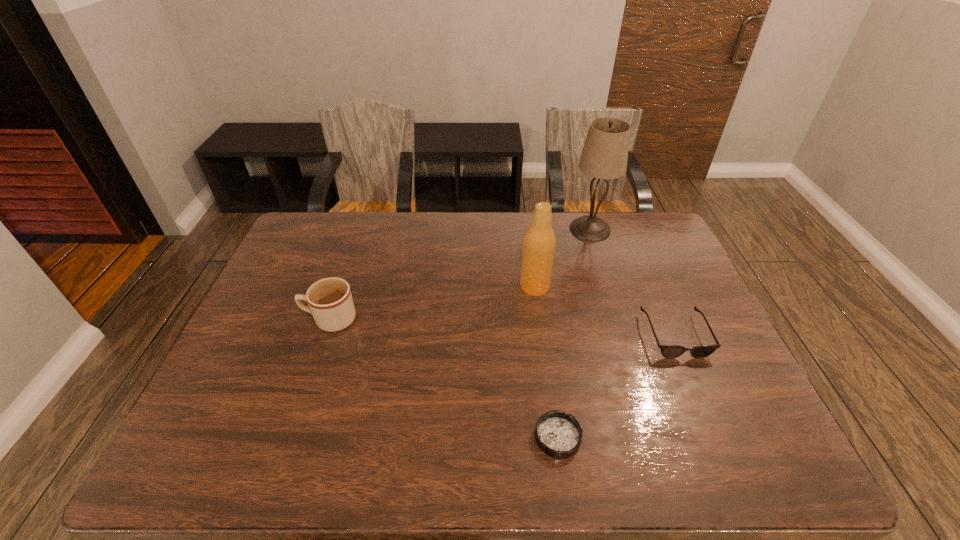
You are a GUI agent. You are given a task and a screenshot of the screen. Output one action in this format:
    pyautogui.click(x=<x>, y=<y>)
    Task: Click on the vacant position at the left edge of the desktop
    The height and width of the screenshot is (540, 960).
    Given the screenshot: What is the action you would take?
    pyautogui.click(x=280, y=272)

You are a GUI agent. You are given a task and a screenshot of the screen. Output one action in this format:
    pyautogui.click(x=<x>, y=<y>)
    Task: Click on the vacant area at the right edge
    
    Given the screenshot: What is the action you would take?
    pyautogui.click(x=653, y=265)

Where is `vacant space at the far left corner of the desktop`? vacant space at the far left corner of the desktop is located at coordinates (346, 215).

The width and height of the screenshot is (960, 540). In order to click on vacant space at the near left corner of the desktop in this screenshot , I will do `click(182, 475)`.

The image size is (960, 540). I want to click on vacant space that is in between the second tallest object and the nearest object, so click(x=546, y=362).

At what (x,y) coordinates should I click in order to perform the action: click on blank region between the leftmost object and the lampshade. Please return your answer as a coordinate pair (x, y). This screenshot has width=960, height=540. Looking at the image, I should click on (460, 274).

You are a GUI agent. You are given a task and a screenshot of the screen. Output one action in this format:
    pyautogui.click(x=<x>, y=<y>)
    Task: Click on the free space that is in between the beer bottle and the tallest object
    The width and height of the screenshot is (960, 540).
    Given the screenshot: What is the action you would take?
    pos(563,258)

Locate an element on the screen. vacant area that lies between the second farthest object and the shortest object is located at coordinates (546, 362).

Image resolution: width=960 pixels, height=540 pixels. Identify the location of free area in between the farthest object and the fourth tallest object. (633, 282).

Find the location of a particular element. The height and width of the screenshot is (540, 960). vacant area that lies between the third tallest object and the sunglasses is located at coordinates (502, 327).